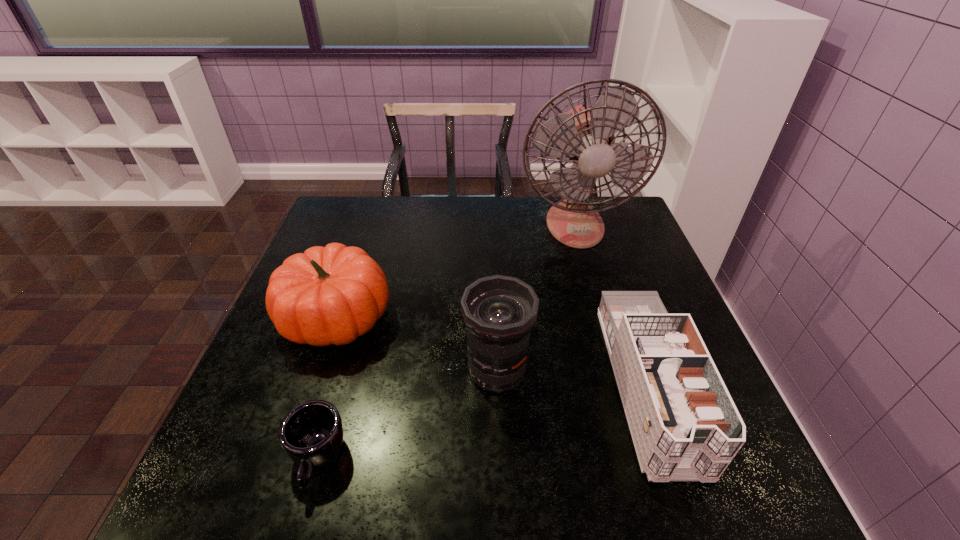
Where is `vacant area between the shortest object and the pumpkin`? The height and width of the screenshot is (540, 960). vacant area between the shortest object and the pumpkin is located at coordinates (327, 388).

Identify the location of free space between the mug and the fan. (446, 342).

Identify the location of empty space between the pumpkin and the mug. This screenshot has height=540, width=960. (327, 388).

Identify the location of the third closest object to the telephoto lens. (311, 434).

Select which object is the second closest to the pumpkin. Please provide its 2D coordinates. Your answer should be formatted as a tuple, i.e. [(x, y)], where the tuple contains the x and y coordinates of a point satisfying the conditions above.

[(499, 312)]

Find the location of a particular element. The height and width of the screenshot is (540, 960). vacant space that satisfies the following two spatial constraints: 1. on the front side of the pumpkin; 2. on the left side of the telephoto lens is located at coordinates (319, 370).